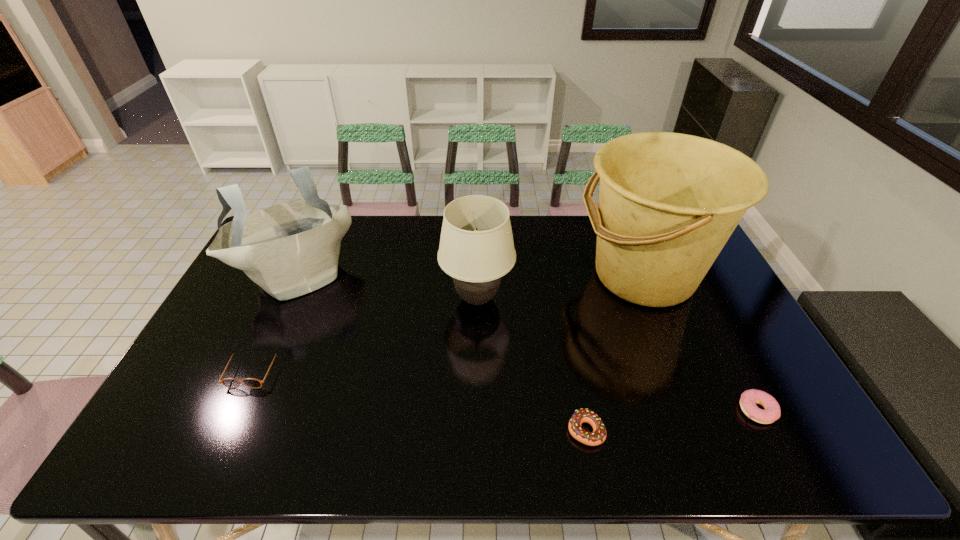
You are a GUI agent. You are given a task and a screenshot of the screen. Output one action in this format:
    pyautogui.click(x=<x>, y=<y>)
    Task: Click on the vacant space that's between the left doughnut and the bucket
    This screenshot has width=960, height=540.
    Given the screenshot: What is the action you would take?
    pyautogui.click(x=614, y=353)

Locate an element on the screen. The width and height of the screenshot is (960, 540). free space between the bucket and the left doughnut is located at coordinates (614, 353).

Identify the location of free space between the third nearest object and the bucket. (x=448, y=323).

Locate an element on the screen. The image size is (960, 540). vacant area that lies between the lampshade and the bucket is located at coordinates (561, 287).

Locate an element on the screen. free space between the bucket and the third object from left to right is located at coordinates (561, 287).

Where is `free space between the lampshade and the shopping bag`? Image resolution: width=960 pixels, height=540 pixels. free space between the lampshade and the shopping bag is located at coordinates (388, 287).

Locate an element on the screen. free point between the third nearest object and the bucket is located at coordinates (448, 323).

Where is `empty space between the right doughnut and the third object from right to left`? empty space between the right doughnut and the third object from right to left is located at coordinates (671, 421).

What are the coordinates of `object that stands as the closest to the bucket` in the screenshot? It's located at (476, 249).

The width and height of the screenshot is (960, 540). I want to click on object identified as the third closest to the third object from right to left, so click(x=772, y=412).